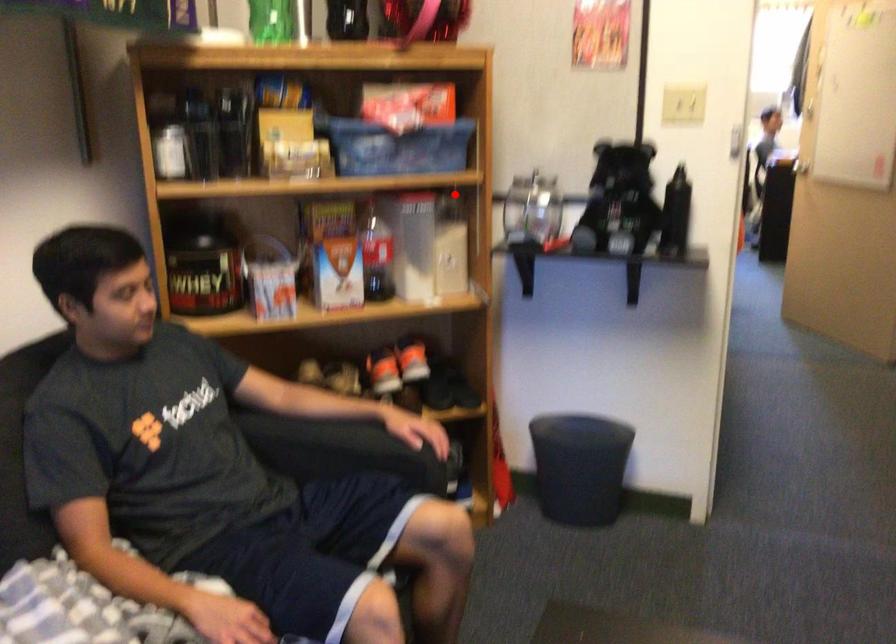
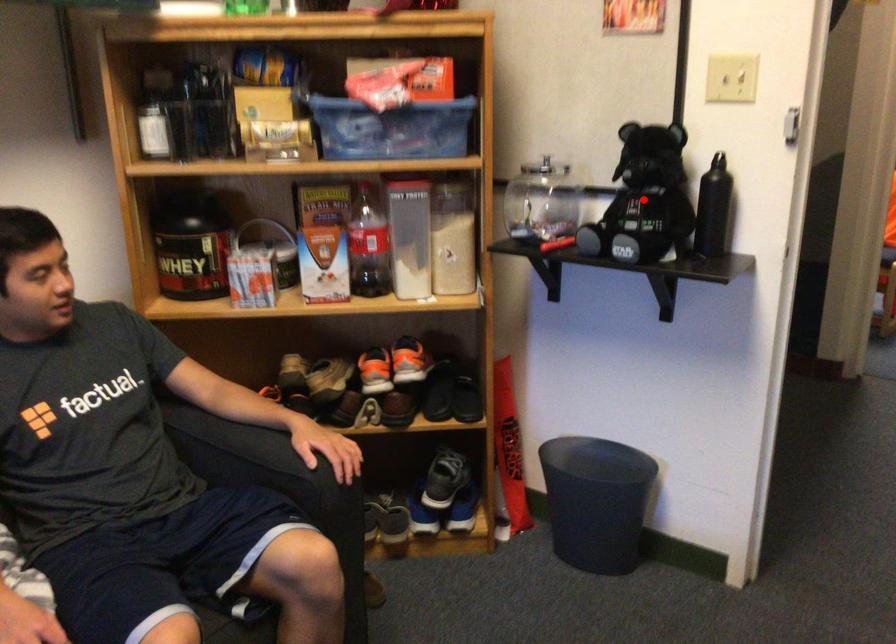
I am providing you with two images of the same scene from different viewpoints. A red point is marked on the first image and another point is marked on the second image. Is the red point in image1 aligned with the point shown in image2?

No